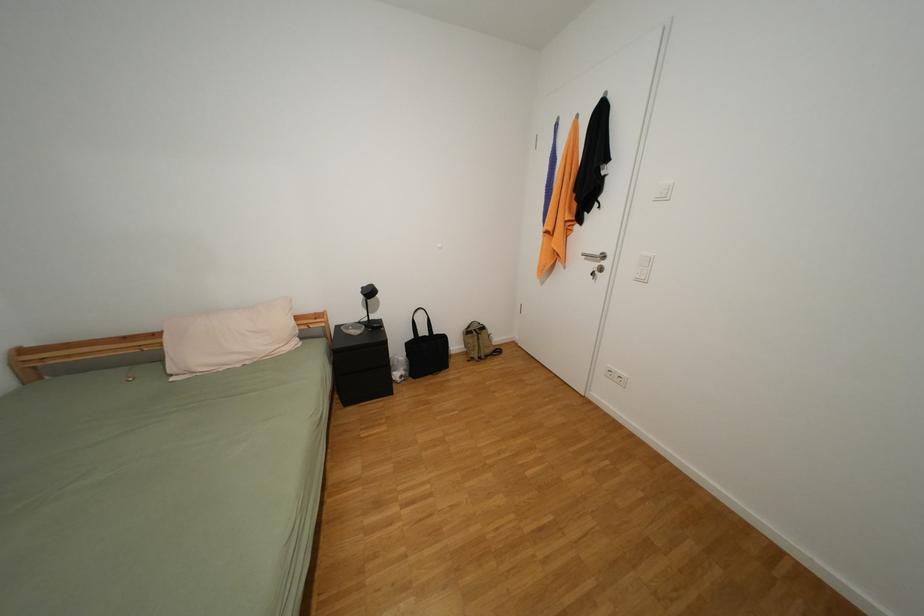
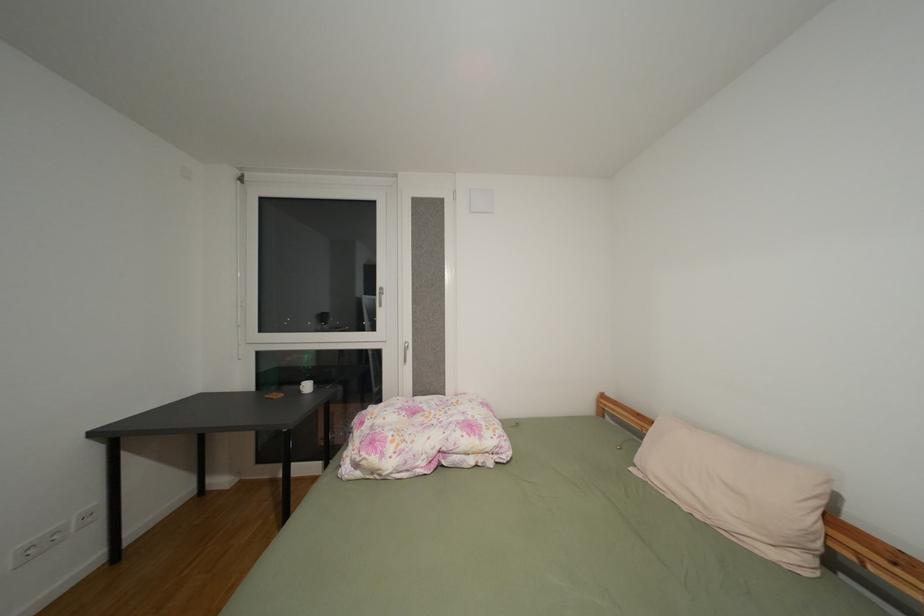
Question: The camera is either moving clockwise (left) or counter-clockwise (right) around the object. The first image is from the beginning of the video and the second image is from the end. Is the camera moving left or right when shooting the video?

Choices:
 (A) Left
 (B) Right

Answer: (B)